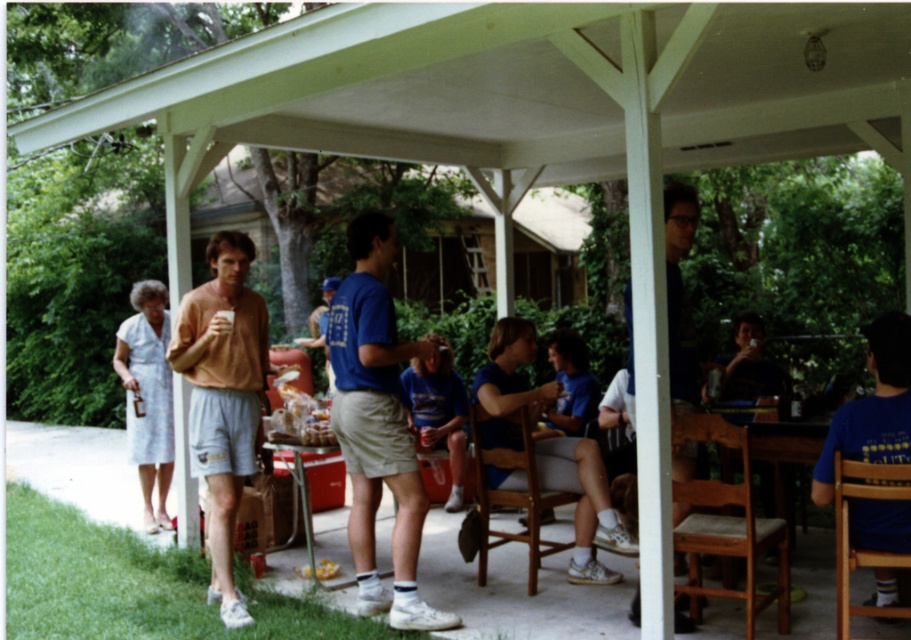
Question: Which of the following is the farthest from the observer?

Choices:
 (A) (252, 257)
 (B) (636, 592)
 (C) (280, 444)

Answer: (C)

Question: Among these objects, which one is nearest to the camera?

Choices:
 (A) metallic silver table at lower center
 (B) blue t-shirt at center
 (C) matte orange shirt at left

Answer: (B)

Question: Which of the following is the closest to the observer?

Choices:
 (A) (213, 397)
 (B) (672, 275)
 (C) (385, 465)
 (D) (293, 528)

Answer: (B)

Question: Can you confirm if blue t-shirt at center is positioned below metallic silver table at lower center?

Choices:
 (A) yes
 (B) no

Answer: (B)

Question: Is matte orange shirt at left further to the viewer compared to matte blue shirt at center?

Choices:
 (A) yes
 (B) no

Answer: (A)

Question: Is the position of blue t-shirt at center less distant than that of matte orange shirt at left?

Choices:
 (A) yes
 (B) no

Answer: (A)